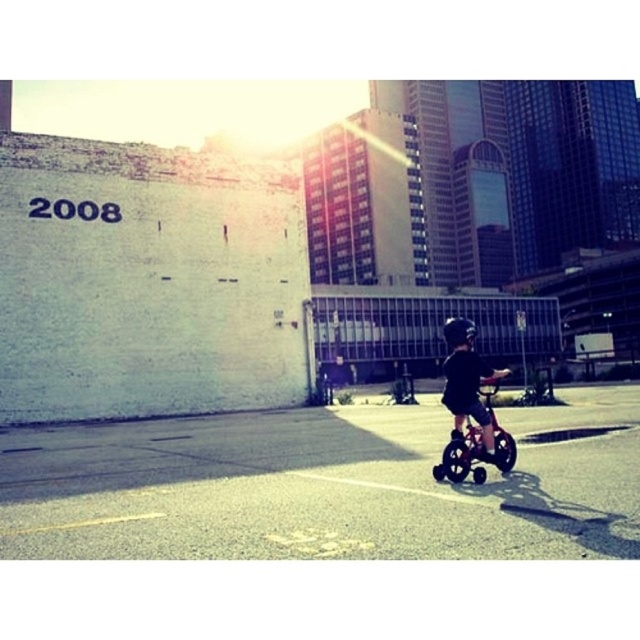
Question: Can you confirm if black matte helmet at center is thinner than black matte bicycle at center?

Choices:
 (A) yes
 (B) no

Answer: (B)

Question: Which of the following is the farthest from the observer?

Choices:
 (A) (492, 413)
 (B) (461, 380)

Answer: (A)

Question: Is black matte helmet at center smaller than black matte bicycle at center?

Choices:
 (A) no
 (B) yes

Answer: (A)

Question: Which point is farther to the camera?

Choices:
 (A) (454, 426)
 (B) (460, 452)

Answer: (A)

Question: Does black matte helmet at center have a smaller size compared to black matte bicycle at center?

Choices:
 (A) no
 (B) yes

Answer: (A)